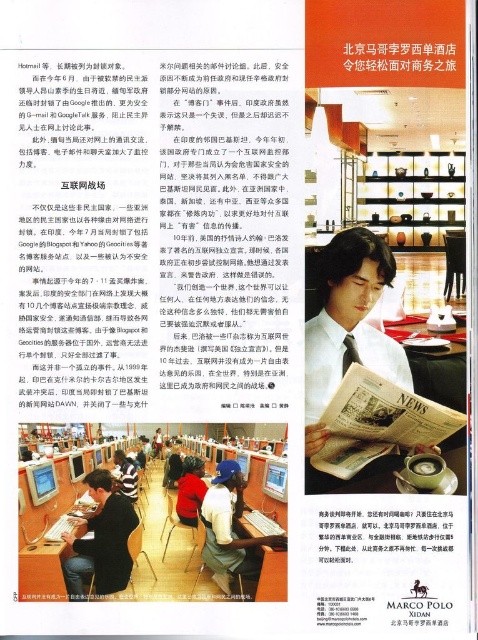
Question: Which point is farther to the camera?

Choices:
 (A) matte black laptop at lower left
 (B) red sweater at center
 (C) matte black laptop at center

Answer: (B)

Question: Does matte black computer at lower left lie in front of red sweater at center?

Choices:
 (A) yes
 (B) no

Answer: (A)

Question: Can you confirm if matte black computer at lower left is smaller than matte black hair at center?

Choices:
 (A) no
 (B) yes

Answer: (A)

Question: Is matte black laptop at center below red sweater at center?

Choices:
 (A) yes
 (B) no

Answer: (A)

Question: Which point is closer to the camera?

Choices:
 (A) matte black laptop at lower left
 (B) matte black hair at center
 (C) wooden shelves at center

Answer: (A)

Question: Which object is farther from the camera taking this photo?

Choices:
 (A) matte black hair at center
 (B) wooden shelves at center
 (C) matte black laptop at lower left
 (D) matte black computer at lower left

Answer: (B)